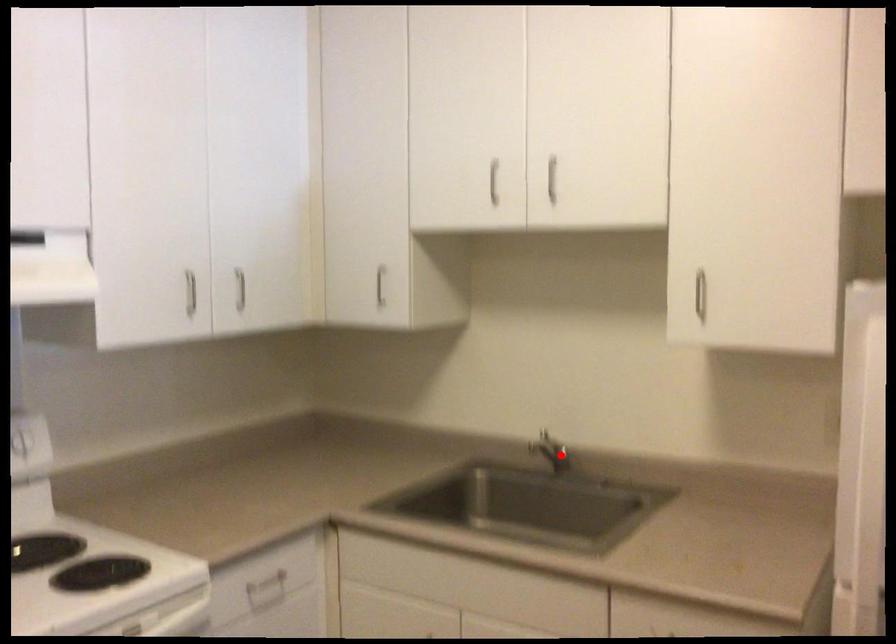
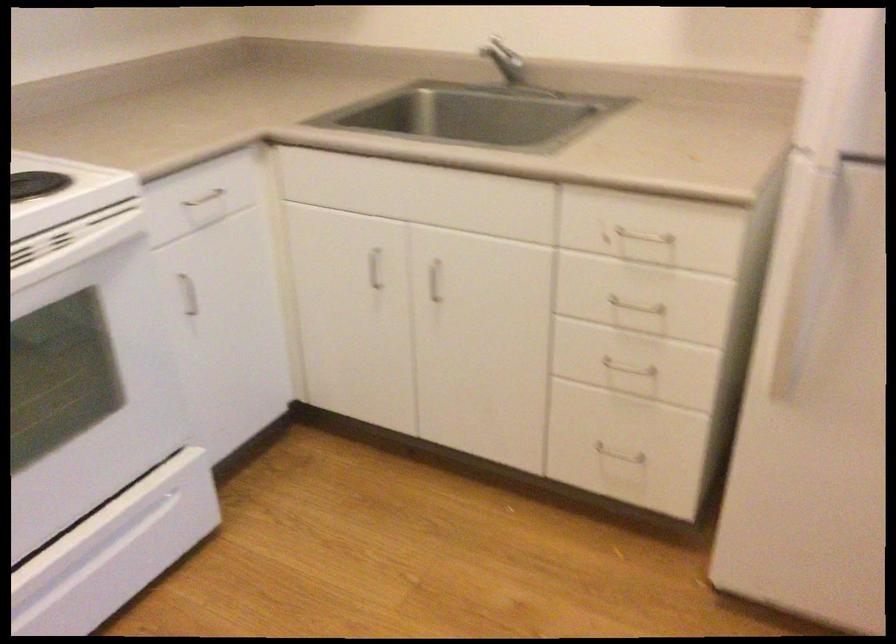
Question: I am providing you with two images of the same scene from different viewpoints. A red point is marked on the first image. Is the red point's position out of view in image 2?

Choices:
 (A) Yes
 (B) No

Answer: (B)